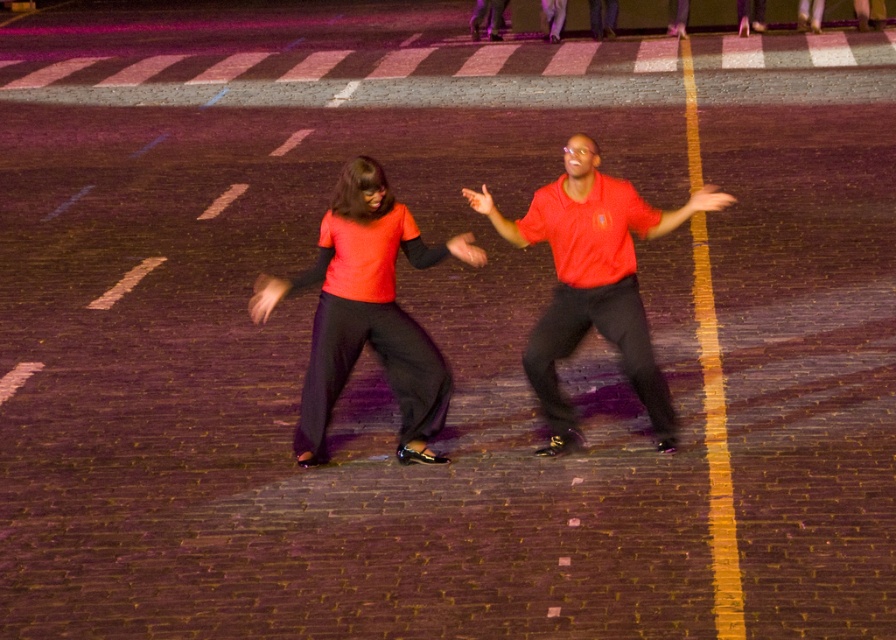
Does matte orange shirt at center have a larger size compared to matte red shirt at center?

Indeed, matte orange shirt at center has a larger size compared to matte red shirt at center.

Does matte orange shirt at center have a lesser width compared to matte red shirt at center?

Yes, matte orange shirt at center is thinner than matte red shirt at center.

The image size is (896, 640). I want to click on matte orange shirt at center, so click(x=367, y=312).

Find the location of `matte orange shirt at center`. matte orange shirt at center is located at coordinates (367, 312).